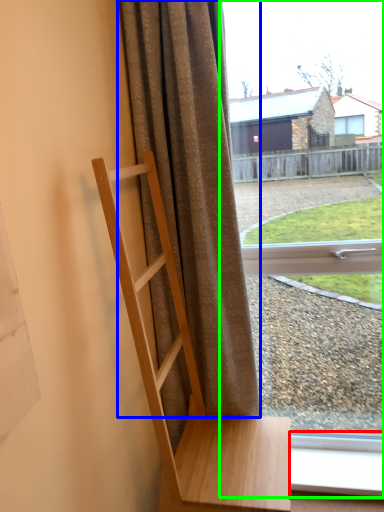
Question: Which object is the farthest from window frame (highlighted by a red box)? Choose among these: curtain (highlighted by a blue box) or window (highlighted by a green box).

Choices:
 (A) curtain
 (B) window

Answer: (B)